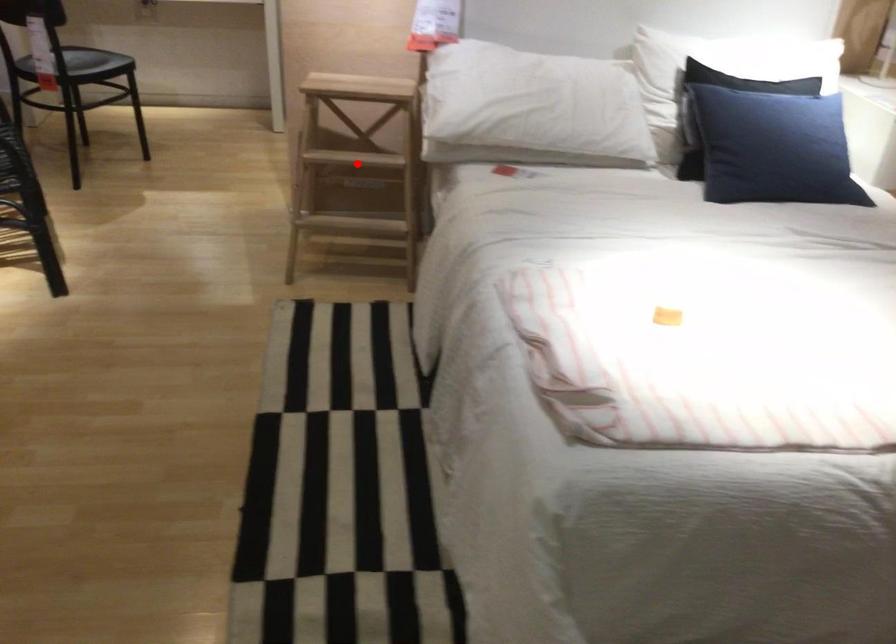
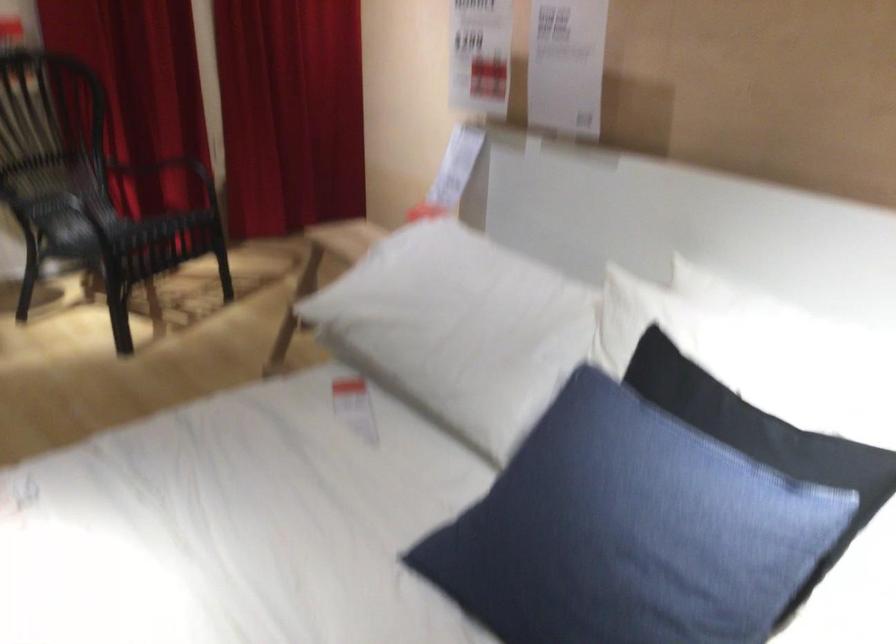
Question: I am providing you with two images of the same scene from different viewpoints. A red point is marked on the first image. Is the red point's position out of view in image 2?

Choices:
 (A) Yes
 (B) No

Answer: (A)